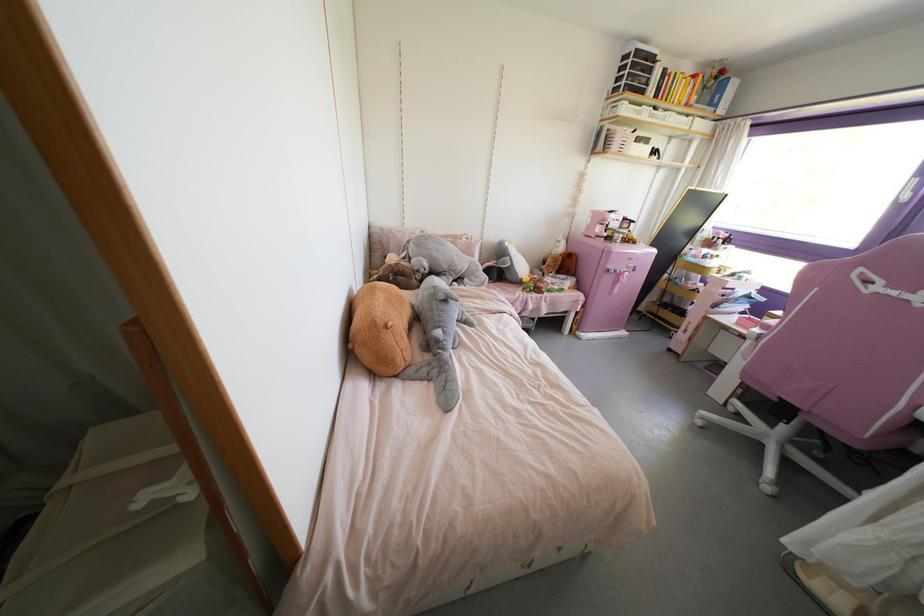
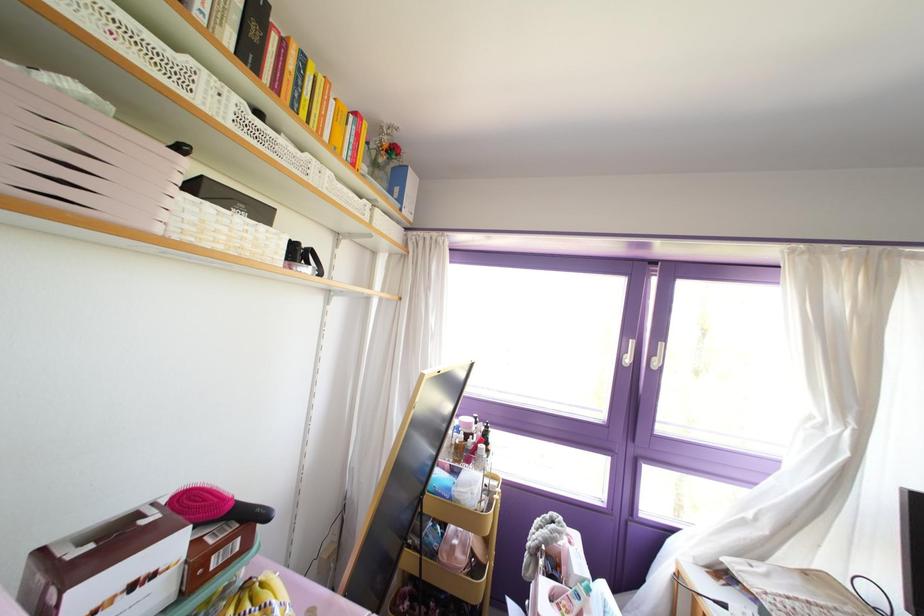
In the second image, find the point that corresponds to (x=686, y=103) in the first image.

(351, 164)